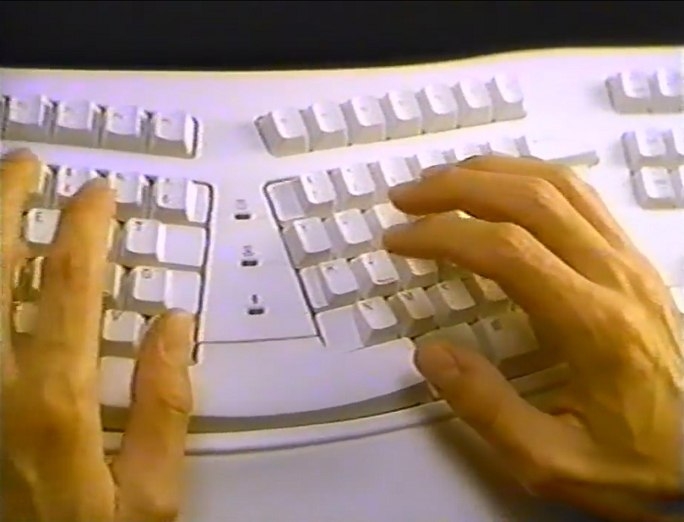
Locate an element on the screen. The height and width of the screenshot is (522, 684). keyboard is located at coordinates (276, 319).